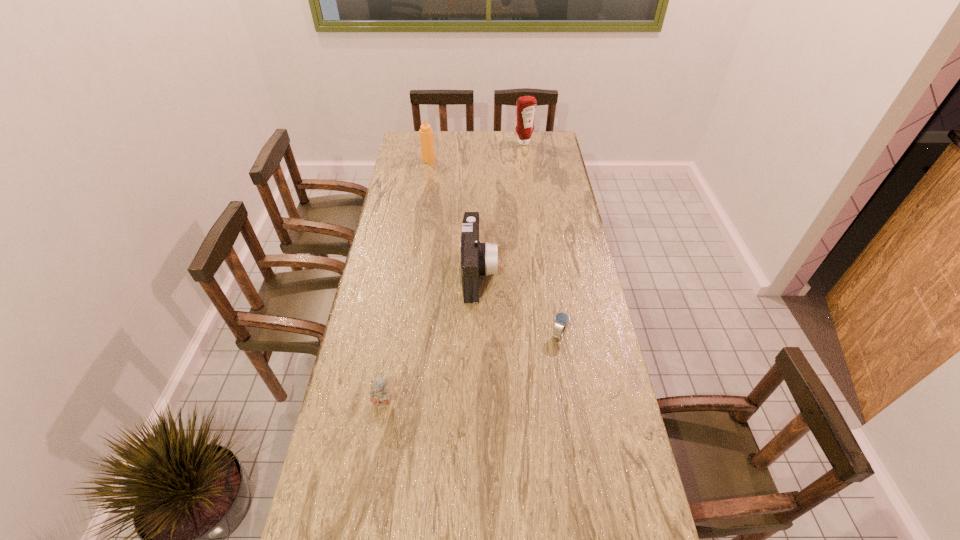
Where is `vacant space located 0.050m on the right of the farthest object`? vacant space located 0.050m on the right of the farthest object is located at coordinates (543, 143).

The width and height of the screenshot is (960, 540). I want to click on free space located 0.090m on the left of the fourth nearest object, so click(x=403, y=160).

Locate an element on the screen. The height and width of the screenshot is (540, 960). vacant space located 0.200m on the lens of the third object from right to left is located at coordinates (552, 273).

Locate an element on the screen. The width and height of the screenshot is (960, 540). vacant space situated on the front-facing side of the nearest object is located at coordinates (371, 476).

In order to click on free space located on the left of the shortest object in this screenshot , I will do `click(442, 334)`.

At what (x,y) coordinates should I click in order to perform the action: click on object present at the far edge. Please return your answer as a coordinate pair (x, y). This screenshot has width=960, height=540. Looking at the image, I should click on (526, 106).

The width and height of the screenshot is (960, 540). What are the coordinates of `condiment that is at the left edge` in the screenshot? It's located at (426, 133).

Where is `teddy bear situated at the left edge`? The width and height of the screenshot is (960, 540). teddy bear situated at the left edge is located at coordinates (380, 397).

You are a GUI agent. You are given a task and a screenshot of the screen. Output one action in this format:
    pyautogui.click(x=<x>, y=<y>)
    Task: Click on the condiment that is at the right edge
    
    Given the screenshot: What is the action you would take?
    pyautogui.click(x=526, y=106)

What are the coordinates of `watch that is at the right edge` in the screenshot? It's located at (561, 319).